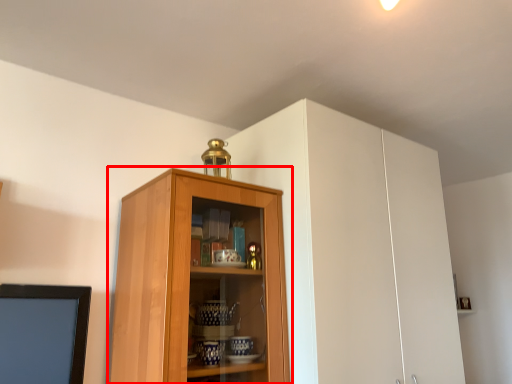
Question: From the image's perspective, where is cupboard (annotated by the red box) located in relation to cabinetry in the image?

Choices:
 (A) above
 (B) below

Answer: (B)